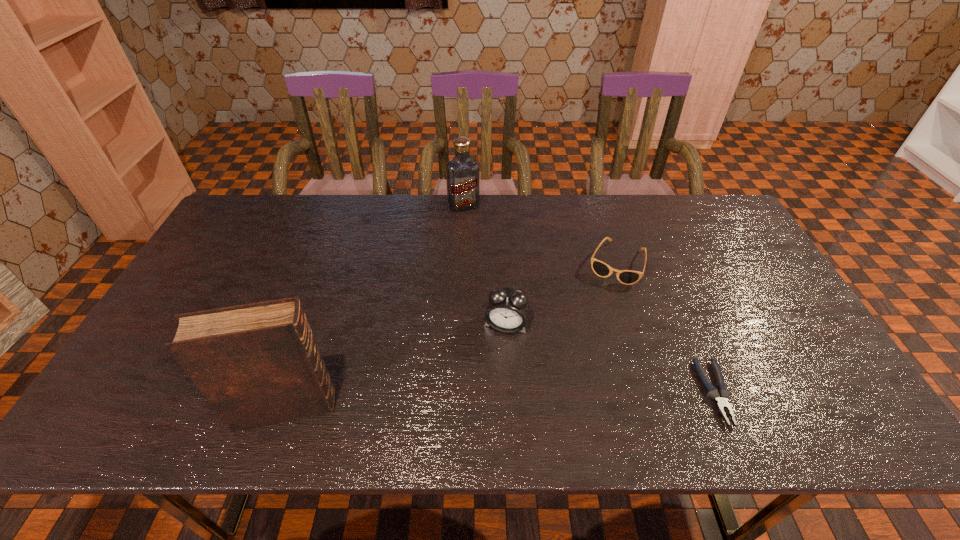
At what (x,y) coordinates should I click in order to perform the action: click on free space that is in between the shortest object and the third tallest object. Please return your answer as a coordinate pair (x, y). Looking at the image, I should click on (611, 359).

Find the location of a particular element. unoccupied position between the alarm clock and the shortest object is located at coordinates (611, 359).

Identify the location of vacant area that lies between the farthest object and the third object from left to right. (485, 265).

The image size is (960, 540). I want to click on blank region between the shortest object and the fourth tallest object, so click(x=665, y=328).

At what (x,y) coordinates should I click in order to perform the action: click on empty space that is in between the third nearest object and the tallest object. Please return your answer as a coordinate pair (x, y). Looking at the image, I should click on (396, 366).

This screenshot has width=960, height=540. Identify the location of empty location between the third object from left to right and the pliers. (611, 359).

Identify the location of the second closest object to the alarm clock. This screenshot has width=960, height=540. (257, 364).

Where is `object that stands as the third closest to the rightmost object`? This screenshot has height=540, width=960. object that stands as the third closest to the rightmost object is located at coordinates 462,171.

Locate an element on the screen. Image resolution: width=960 pixels, height=540 pixels. free space that satisfies the following two spatial constraints: 1. on the back side of the second object from right to left; 2. on the left side of the alarm clock is located at coordinates (503, 263).